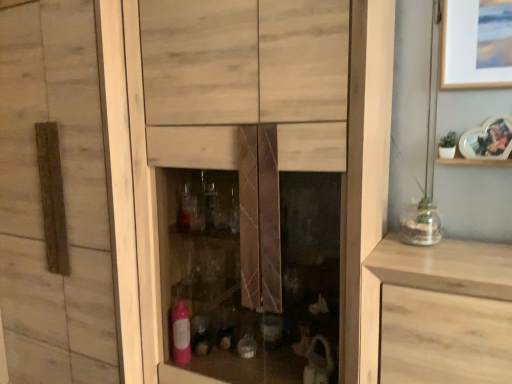
Question: Considering the positions of point (387, 352) and point (417, 220), is point (387, 352) closer or farther from the camera than point (417, 220)?

Choices:
 (A) farther
 (B) closer

Answer: (B)

Question: In terms of height, does light wood drawer at right look taller or shorter compared to clear glass vase at right?

Choices:
 (A) short
 (B) tall

Answer: (B)

Question: Estimate the real-world distances between objects in this image. Which object is farther from the wooden shelf at upper right?

Choices:
 (A) clear glass vase at right
 (B) heart-shaped photo frame at upper right
 (C) light wood drawer at right

Answer: (C)

Question: Which object is the farthest from the light wood drawer at right?

Choices:
 (A) clear glass vase at right
 (B) wooden shelf at upper right
 (C) heart-shaped photo frame at upper right

Answer: (C)